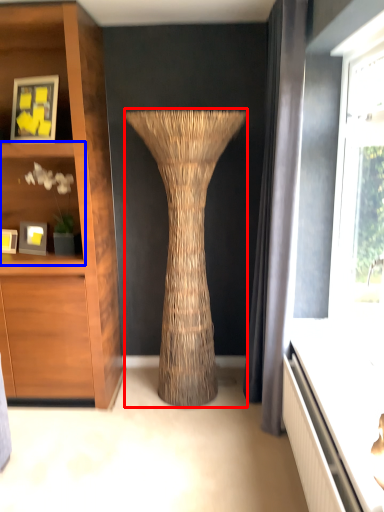
Question: Among these objects, which one is nearest to the camera, vase (highlighted by a red box) or shelf (highlighted by a blue box)?

Choices:
 (A) vase
 (B) shelf

Answer: (A)